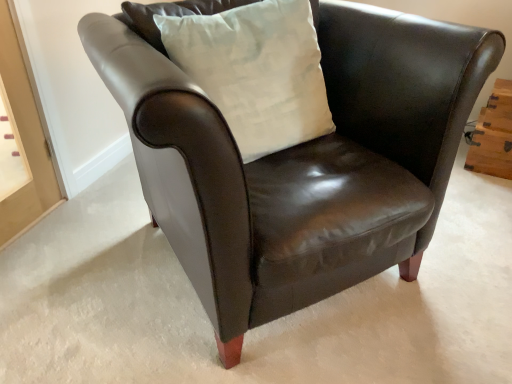
Question: Could you tell me if white cotton pillow at upper center is turned towards wooden drawer at right?

Choices:
 (A) no
 (B) yes

Answer: (A)

Question: From the image's perspective, is white cotton pillow at upper center located above wooden drawer at right?

Choices:
 (A) no
 (B) yes

Answer: (B)

Question: Is white cotton pillow at upper center bigger than wooden drawer at right?

Choices:
 (A) no
 (B) yes

Answer: (B)

Question: Does white cotton pillow at upper center appear on the right side of wooden drawer at right?

Choices:
 (A) yes
 (B) no

Answer: (B)

Question: Is white cotton pillow at upper center smaller than wooden drawer at right?

Choices:
 (A) yes
 (B) no

Answer: (B)

Question: From a real-world perspective, is white cotton pillow at upper center below wooden drawer at right?

Choices:
 (A) no
 (B) yes

Answer: (A)

Question: Does wooden drawer at right have a greater height compared to white cotton pillow at upper center?

Choices:
 (A) no
 (B) yes

Answer: (A)

Question: Does wooden drawer at right appear on the right side of white cotton pillow at upper center?

Choices:
 (A) yes
 (B) no

Answer: (A)

Question: Is the depth of wooden drawer at right greater than that of white cotton pillow at upper center?

Choices:
 (A) yes
 (B) no

Answer: (A)

Question: From a real-world perspective, does wooden drawer at right sit lower than white cotton pillow at upper center?

Choices:
 (A) yes
 (B) no

Answer: (A)

Question: Are wooden drawer at right and white cotton pillow at upper center beside each other?

Choices:
 (A) yes
 (B) no

Answer: (B)

Question: Can white cotton pillow at upper center be found inside wooden drawer at right?

Choices:
 (A) no
 (B) yes

Answer: (A)

Question: From the image's perspective, relative to white cotton pillow at upper center, is wooden drawer at right above or below?

Choices:
 (A) below
 (B) above

Answer: (A)